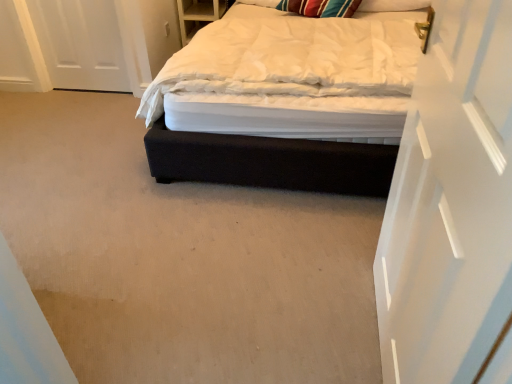
I want to click on free region on the left part of white glossy door at upper right, so [x=286, y=322].